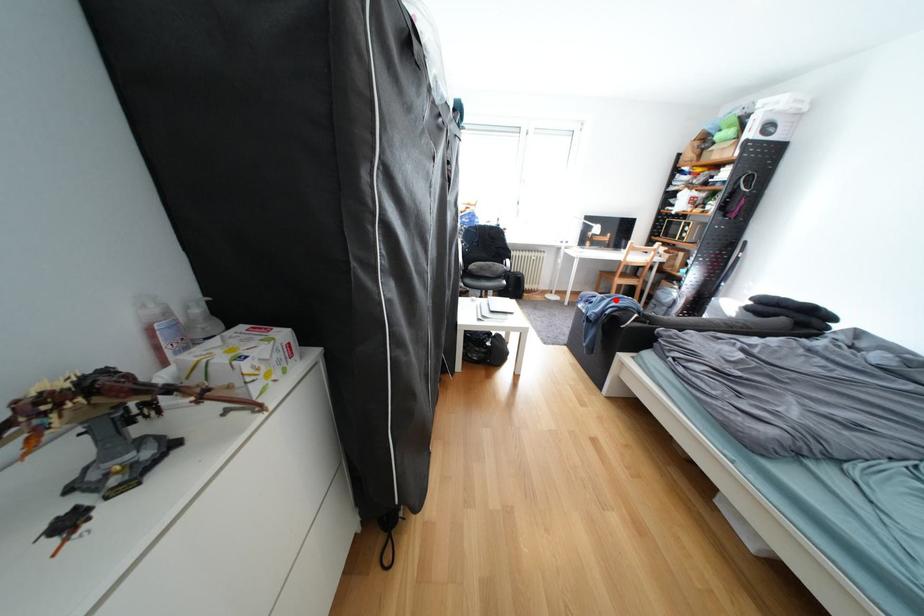
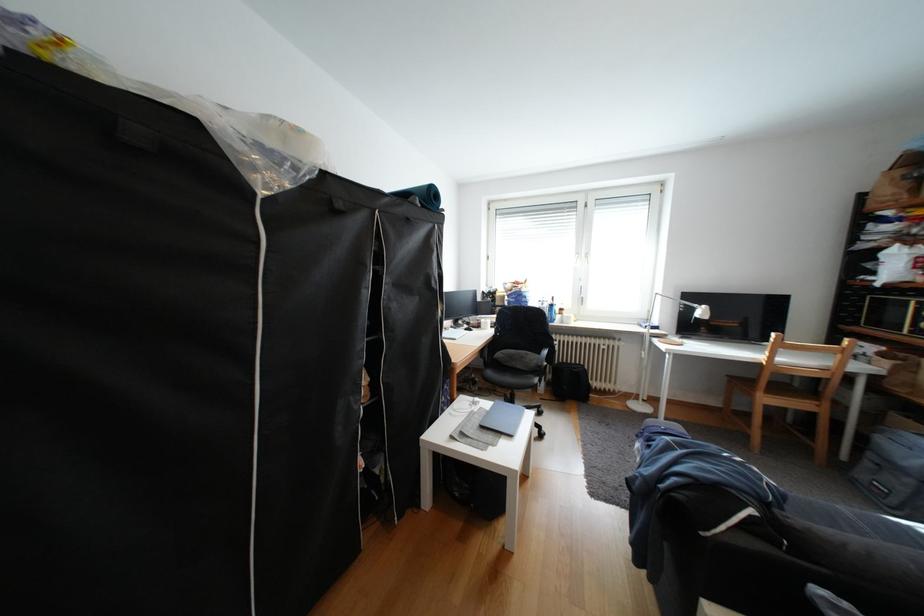
In the second image, find the point that corresponds to the highlighted location in the first image.

(682, 448)